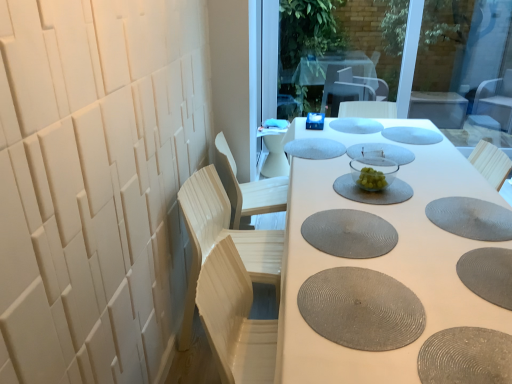
Question: Considering the positions of point (219, 360) and point (470, 349), is point (219, 360) closer or farther from the camera than point (470, 349)?

Choices:
 (A) farther
 (B) closer

Answer: (A)

Question: Is light wood swivel chair at left to the left or to the right of textured gray manhole cover at lower right, the first manhole cover from the front, in the image?

Choices:
 (A) left
 (B) right

Answer: (A)

Question: Which object is the closest to the gray rubber mat at center, which appears as the 9th manhole cover when viewed from the front?

Choices:
 (A) gray textured placemat at lower right, which is the fifth manhole cover from front to back
 (B) clear glass bowl at center
 (C) textured gray manhole cover at lower right, which is the 10th manhole cover from back to front
 (D) transparent glass window screen at upper center
 (E) light wood swivel chair at left

Answer: (B)

Question: Estimate the real-world distances between objects in this image. Which object is closer to the gray textured placemat at lower right, the 6th manhole cover in the back-to-front sequence?

Choices:
 (A) blue fabric cushion at center, the 10th manhole cover positioned from the front
 (B) light wood chair at center, placed as the 2th chair when sorted from front to back
 (C) clear glass bowl at center
 (D) gray textured placemat at center, which is counted as the fourth manhole cover, starting from the front
 (E) gray rubber mat at center, which appears as the 2th manhole cover when viewed from the back

Answer: (D)